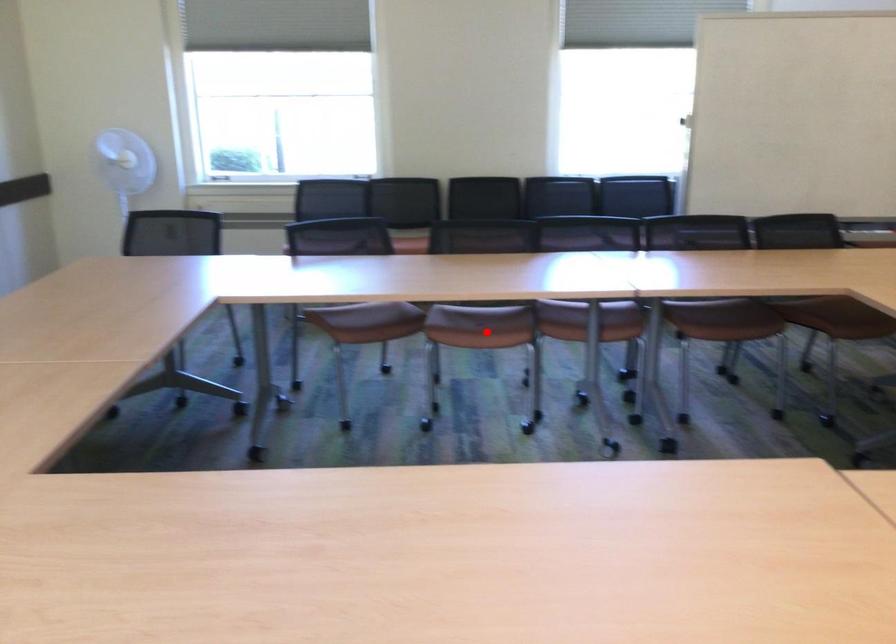
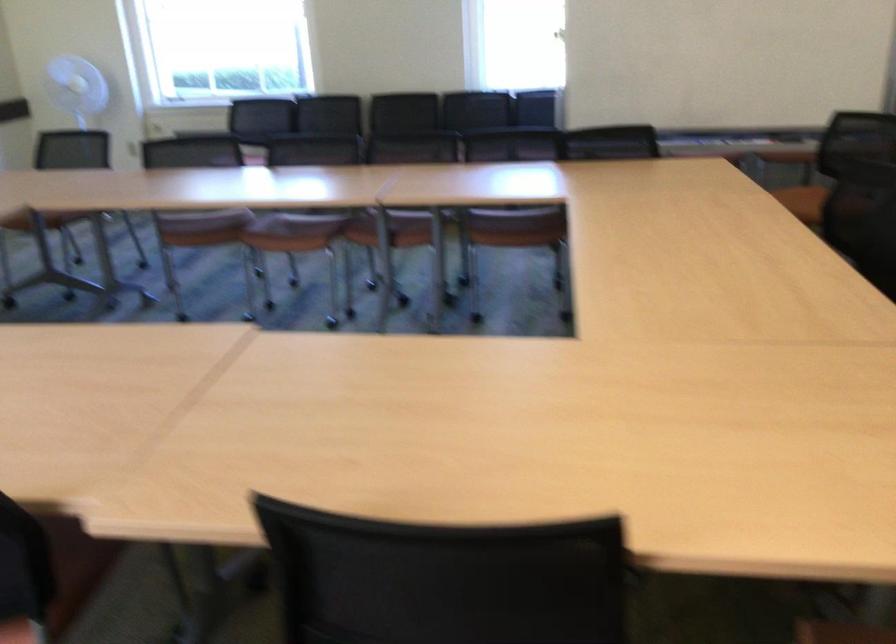
Find the pixel in the second image that matches the highlighted location in the first image.

(293, 232)